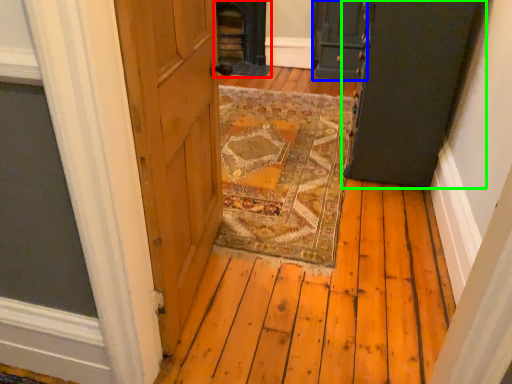
Question: Which object is positioned closest to fireplace (highlighted by a red box)? Select from door (highlighted by a blue box) and door (highlighted by a green box).

Choices:
 (A) door
 (B) door

Answer: (A)